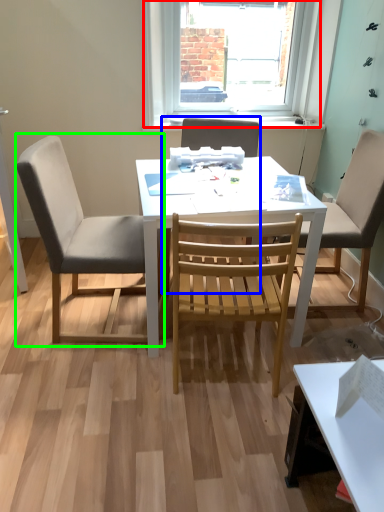
Question: Estimate the real-world distances between objects in this image. Which object is closer to window (highlighted by a red box), chair (highlighted by a blue box) or chair (highlighted by a green box)?

Choices:
 (A) chair
 (B) chair

Answer: (A)